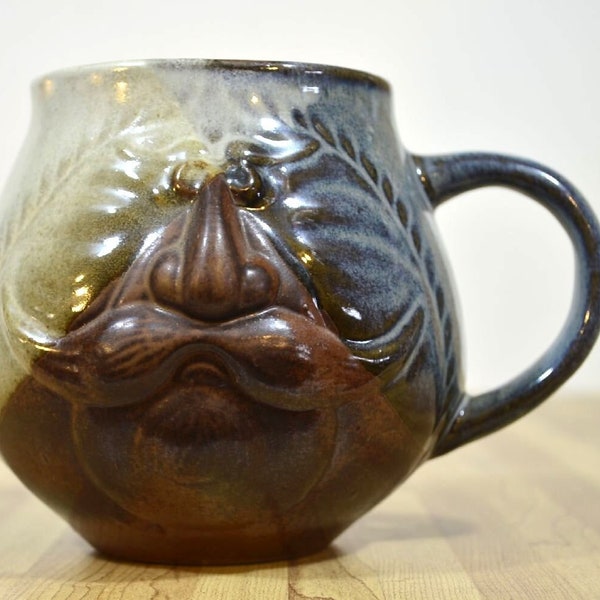
Locate an element on the screen. Image resolution: width=600 pixels, height=600 pixels. table is located at coordinates (439, 575).